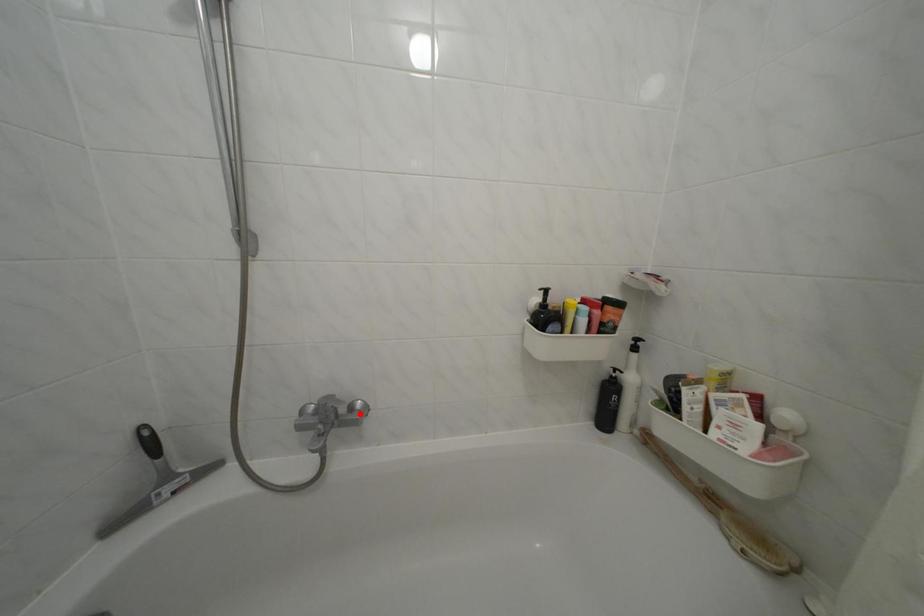
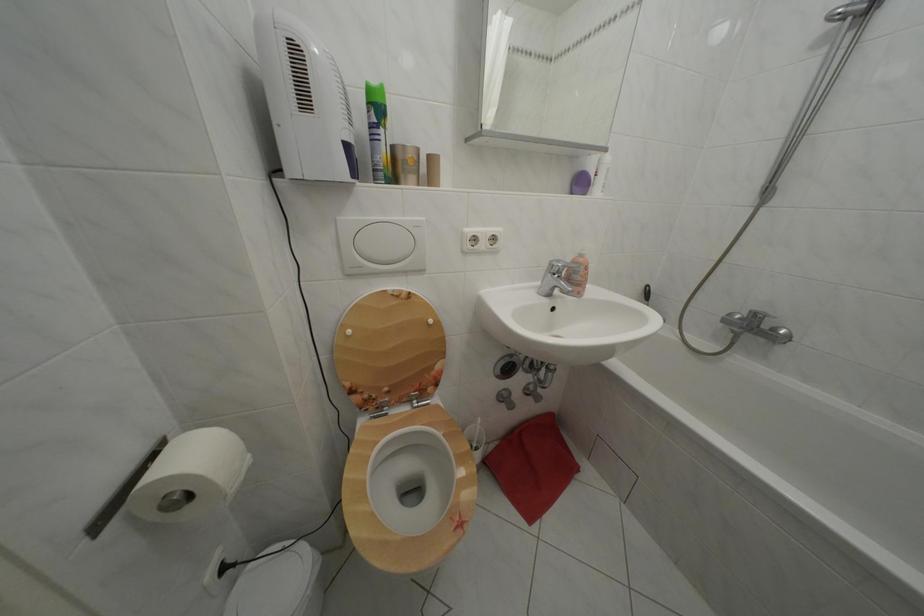
In the second image, find the point that corresponds to the highlighted location in the first image.

(783, 336)